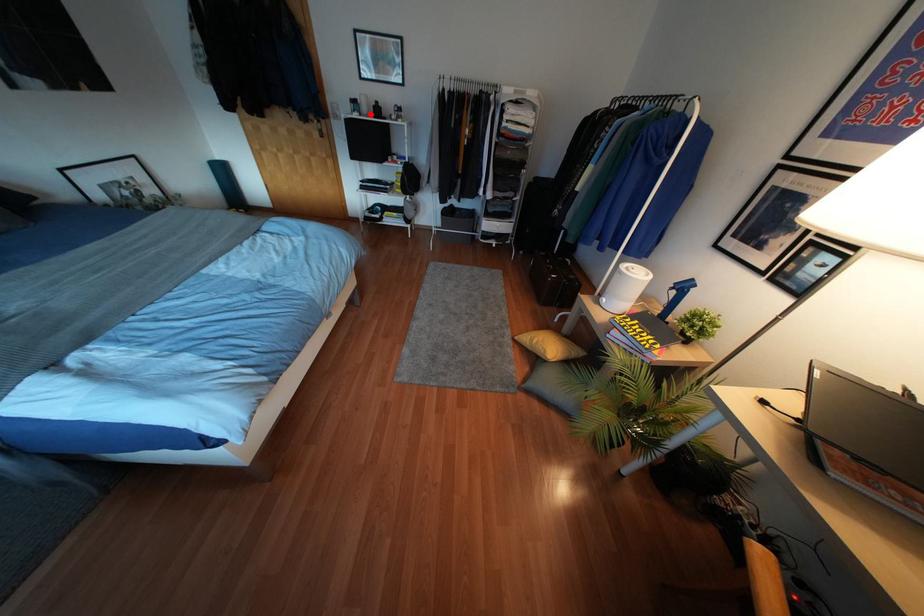
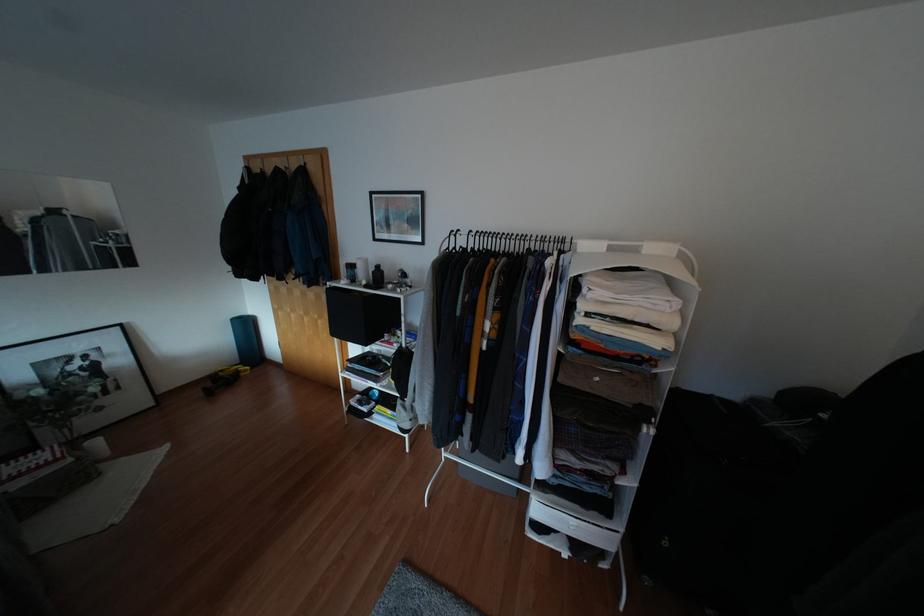
Question: I am providing you with two images of the same scene from different viewpoints. A red point is marked on the first image. At the location where the point appears in image 1, is it still visible in image 2?

Choices:
 (A) Yes
 (B) No

Answer: (A)